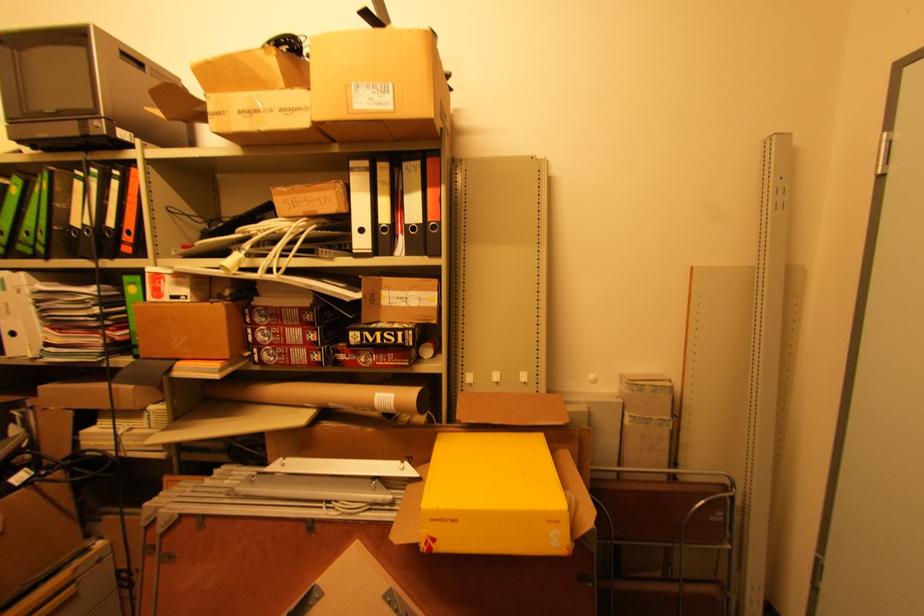
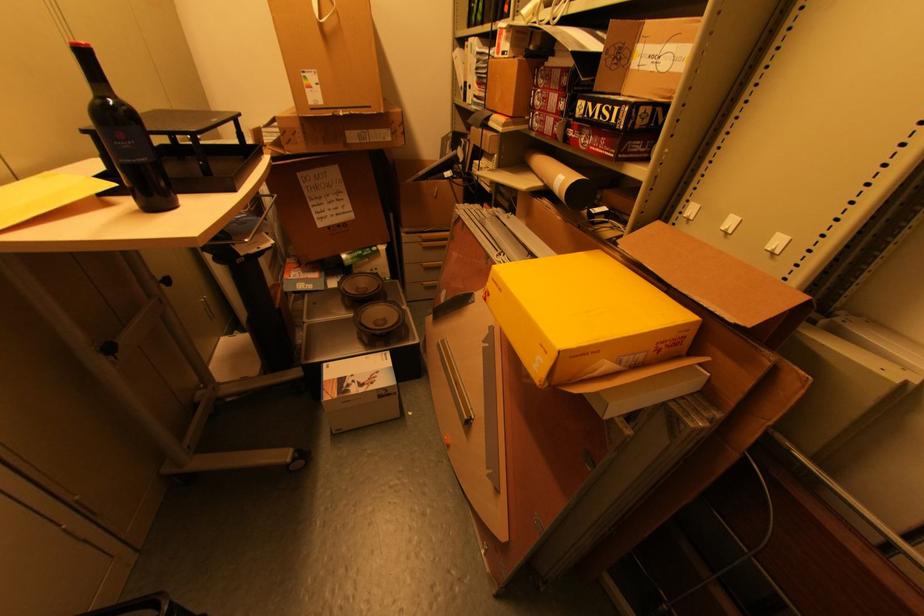
The point at (385, 362) is marked in the first image. Where is the corresponding point in the second image?

(599, 148)